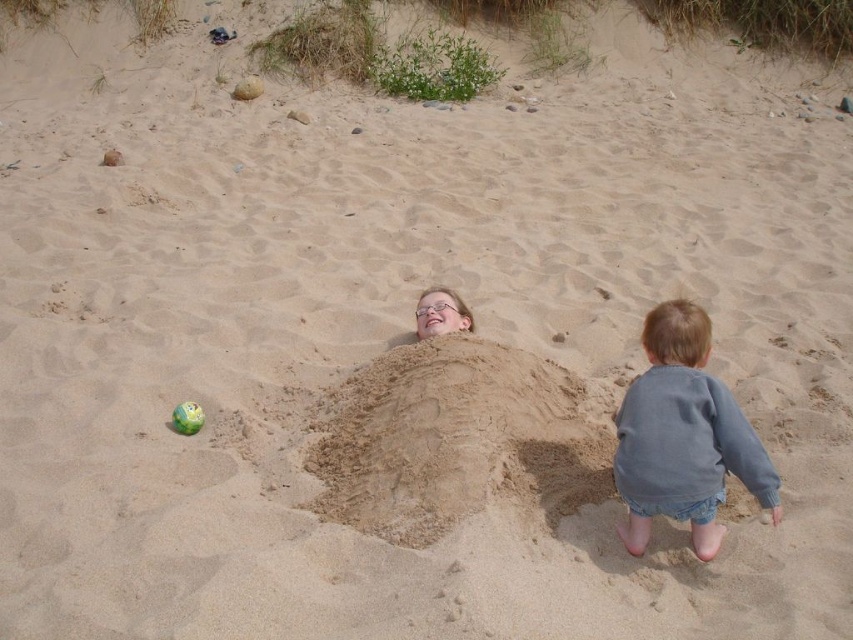
Question: Among these points, which one is nearest to the camera?

Choices:
 (A) (397, 544)
 (B) (175, 416)

Answer: (A)

Question: Is denim shorts at lower right positioned behind green rubber ball at center?

Choices:
 (A) yes
 (B) no

Answer: (B)

Question: Is beige sand mound at center positioned before denim shorts at lower right?

Choices:
 (A) yes
 (B) no

Answer: (B)

Question: Which point is farther to the camera?

Choices:
 (A) [x=392, y=444]
 (B) [x=775, y=518]
 (C) [x=196, y=419]

Answer: (C)

Question: Among these points, which one is farthest from the camera?

Choices:
 (A) (688, 342)
 (B) (316, 513)

Answer: (B)

Question: Is beige sand mound at center thinner than denim shorts at lower right?

Choices:
 (A) yes
 (B) no

Answer: (B)